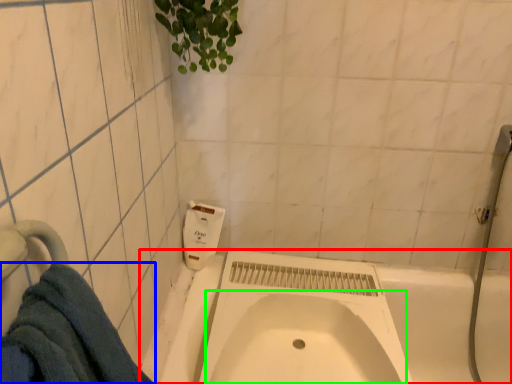
Question: Which object is positioned farthest from bath (highlighted by a red box)? Select from towel (highlighted by a blue box) and sink (highlighted by a green box).

Choices:
 (A) towel
 (B) sink

Answer: (A)